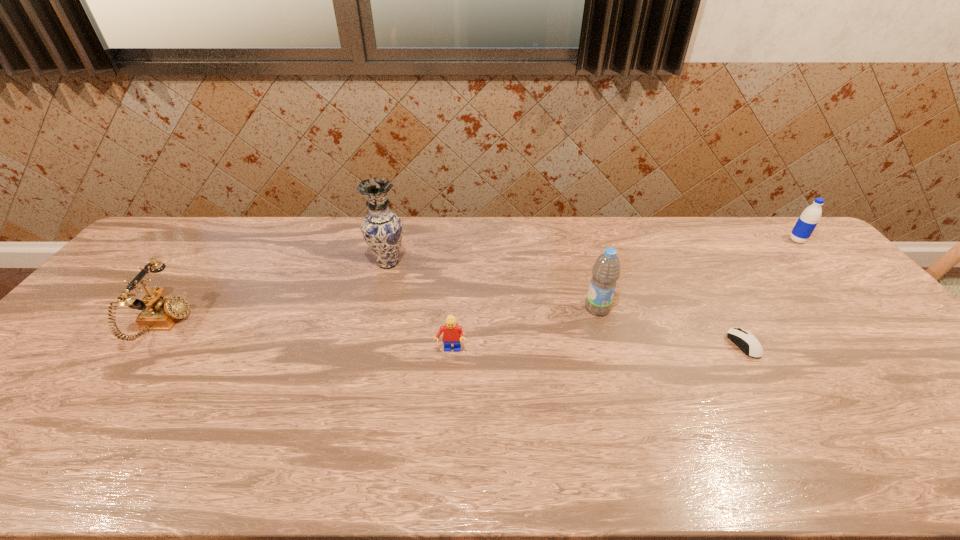
You are a GUI agent. You are given a task and a screenshot of the screen. Output one action in this format:
    pyautogui.click(x=<x>, y=<y>)
    Task: Click on the tallest object
    The height and width of the screenshot is (540, 960).
    Given the screenshot: What is the action you would take?
    pyautogui.click(x=382, y=229)

Find the location of a particular element. Image resolution: width=960 pixels, height=540 pixels. vase is located at coordinates (382, 229).

Locate an element on the screen. This screenshot has height=540, width=960. the taller water bottle is located at coordinates (606, 270).

This screenshot has height=540, width=960. In order to click on the left water bottle in this screenshot , I will do `click(606, 270)`.

What are the coordinates of `telephone` in the screenshot? It's located at (159, 313).

Identify the location of the rightmost object. coord(810,217).

In order to click on the shorter water bottle in this screenshot , I will do `click(810, 217)`.

The height and width of the screenshot is (540, 960). Find the location of `the third object from left to right`. the third object from left to right is located at coordinates (452, 333).

You are a GUI agent. You are given a task and a screenshot of the screen. Output one action in this format:
    pyautogui.click(x=<x>, y=<y>)
    Task: Click on the Lego
    Image resolution: width=960 pixels, height=540 pixels.
    Given the screenshot: What is the action you would take?
    pyautogui.click(x=452, y=333)

The height and width of the screenshot is (540, 960). What are the coordinates of `the shortest object` in the screenshot? It's located at (747, 342).